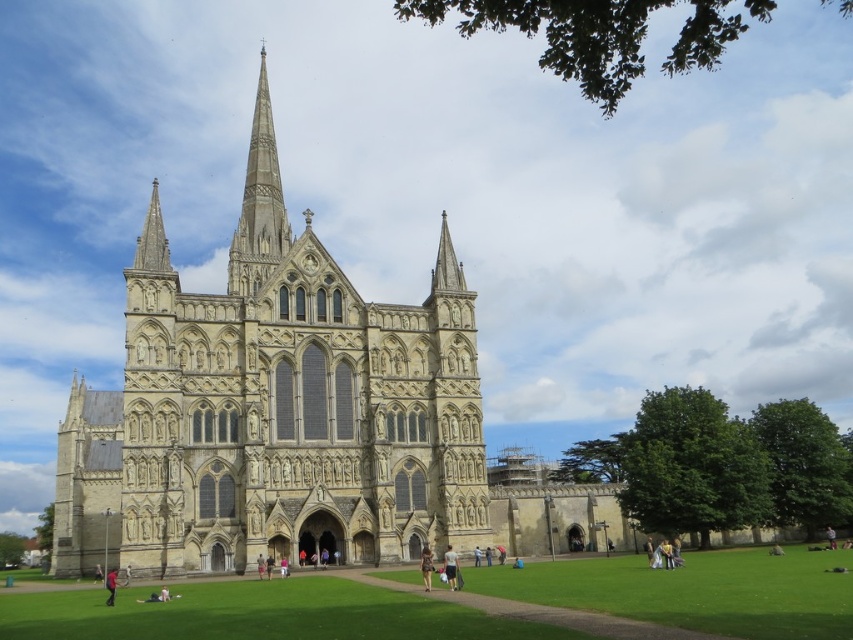
Question: From the image, what is the correct spatial relationship of green grass at lower center in relation to red fabric person at lower left?

Choices:
 (A) left
 (B) right

Answer: (B)

Question: Does beige stone church at center appear under brown fabric dress at center?

Choices:
 (A) no
 (B) yes

Answer: (A)

Question: Which point is closer to the camera taking this photo?

Choices:
 (A) (112, 589)
 (B) (251, 164)

Answer: (A)

Question: Which point is closer to the camera?

Choices:
 (A) (264, 172)
 (B) (744, 620)
 (C) (451, 566)

Answer: (B)

Question: Can you confirm if beige stone church at center is positioned to the right of red fabric person at lower left?

Choices:
 (A) no
 (B) yes

Answer: (A)

Question: Which point is closer to the camera taking this photo?

Choices:
 (A) click(x=112, y=588)
 (B) click(x=270, y=202)
 (C) click(x=453, y=563)
 (D) click(x=167, y=609)

Answer: (D)